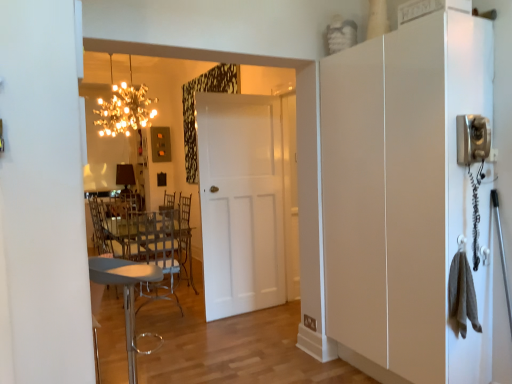
You are a GUI agent. You are given a task and a screenshot of the screen. Output one action in this format:
    pyautogui.click(x=<x>, y=<y>)
    Task: Click on the free space above white matte door at center (from a real-world perspective)
    
    Given the screenshot: What is the action you would take?
    pyautogui.click(x=237, y=95)